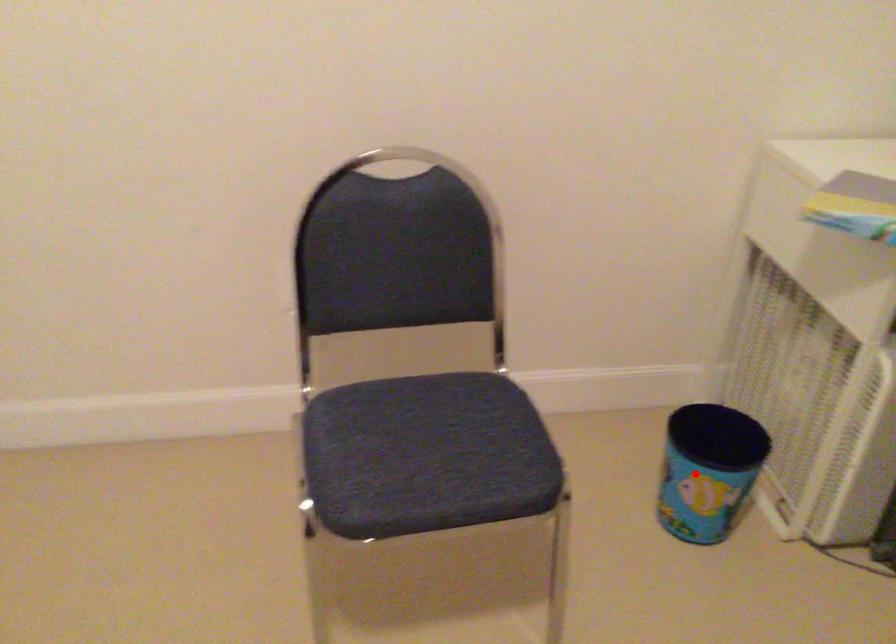
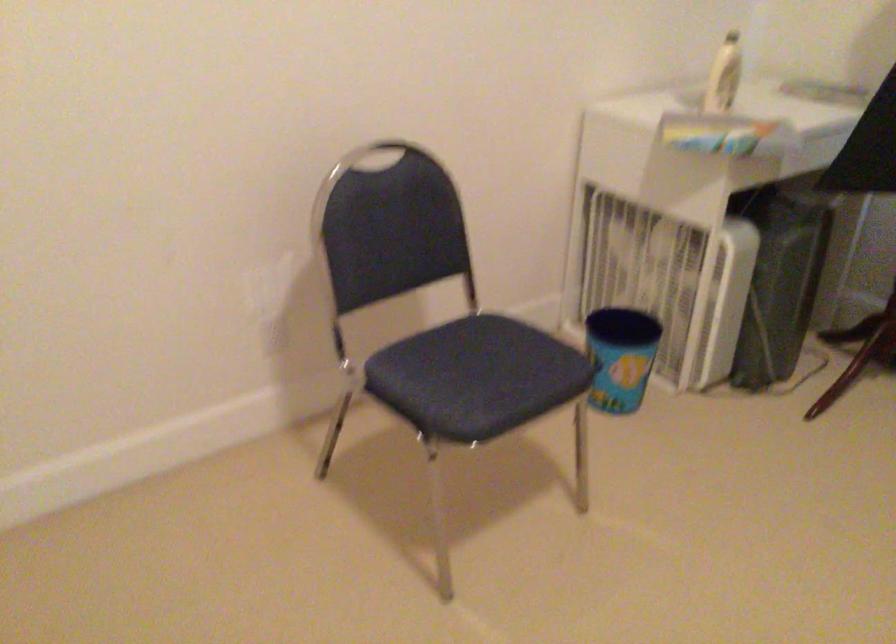
In the second image, find the point that corresponds to the highlighted location in the first image.

(619, 357)